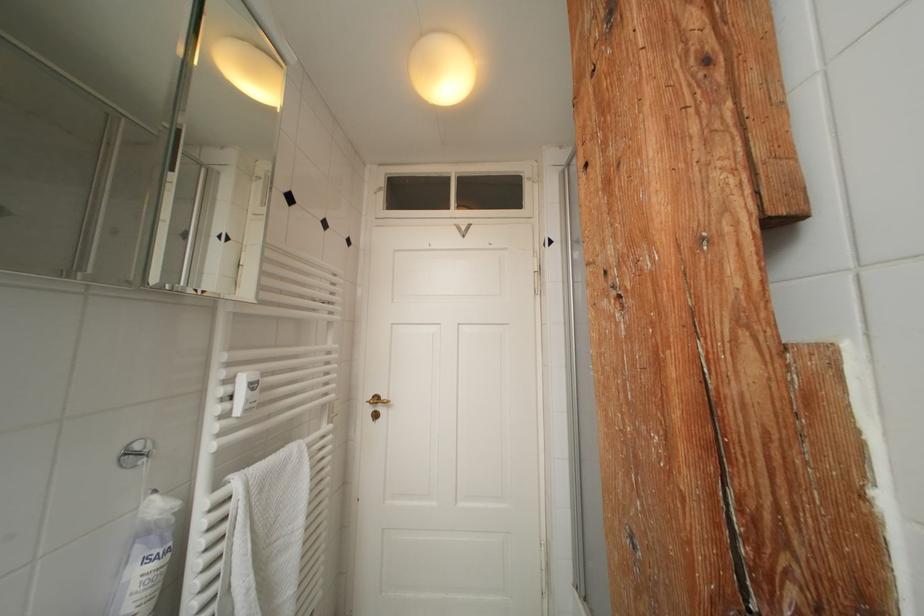
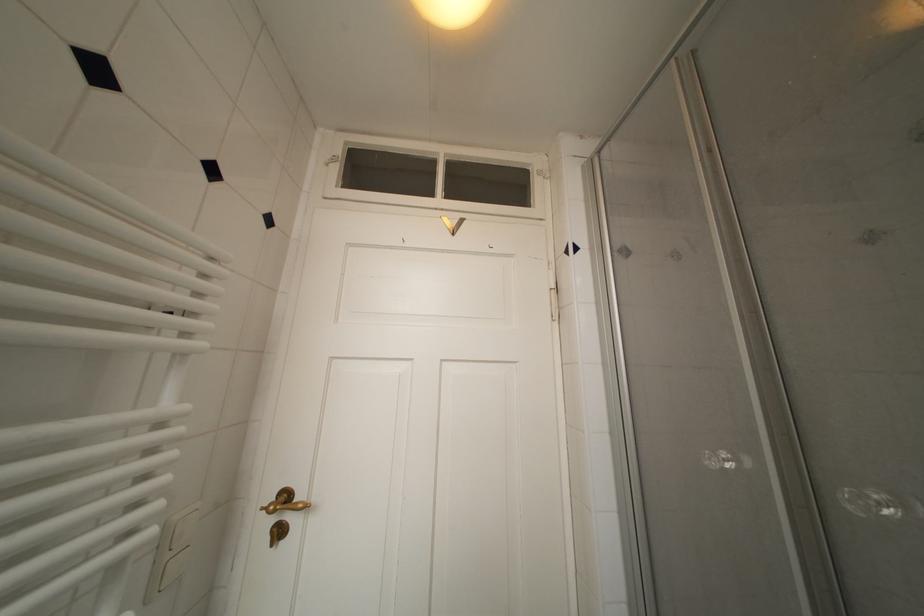
In the second image, find the point that corresponds to the point at 383,402 in the first image.

(293, 500)